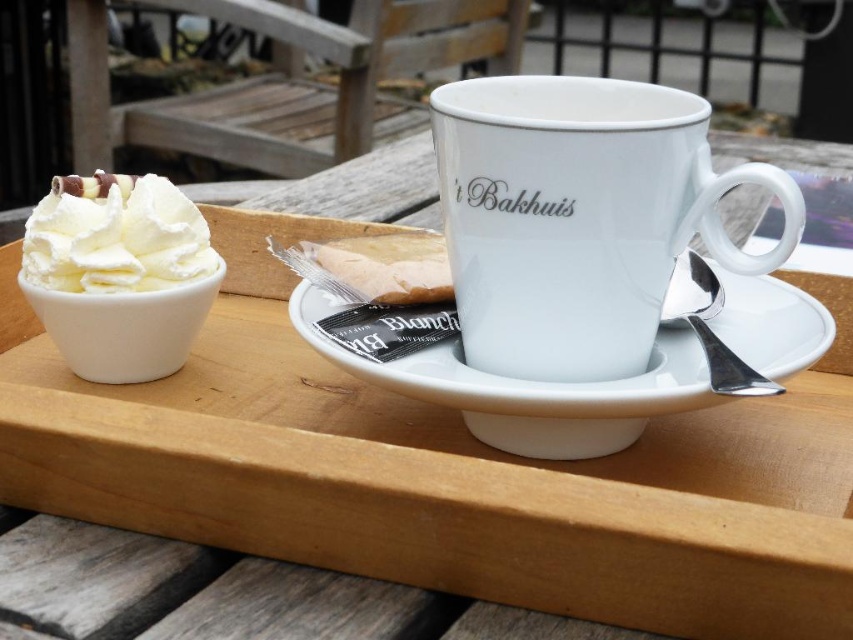
Can you confirm if white porcelain mug at center is smaller than white ceramic plate at center?

Correct, white porcelain mug at center occupies less space than white ceramic plate at center.

Describe the element at coordinates (579, 218) in the screenshot. This screenshot has height=640, width=853. I see `white porcelain mug at center` at that location.

Where is `white porcelain mug at center`? This screenshot has width=853, height=640. white porcelain mug at center is located at coordinates (579, 218).

Between point (798, 332) and point (421, 300), which one is positioned behind?

The point (421, 300) is more distant.

Which is in front, point (683, 378) or point (393, 243)?

Positioned in front is point (683, 378).

The image size is (853, 640). Identify the location of white ceramic plate at center. (521, 380).

Is white porcelain mug at center taller than smooth brownie at center?

Yes.

Who is more distant from viewer, (469, 161) or (354, 260)?

Point (354, 260)

Is point (643, 202) closer to camera compared to point (380, 298)?

That is True.

The height and width of the screenshot is (640, 853). Identify the location of white porcelain mug at center. (579, 218).